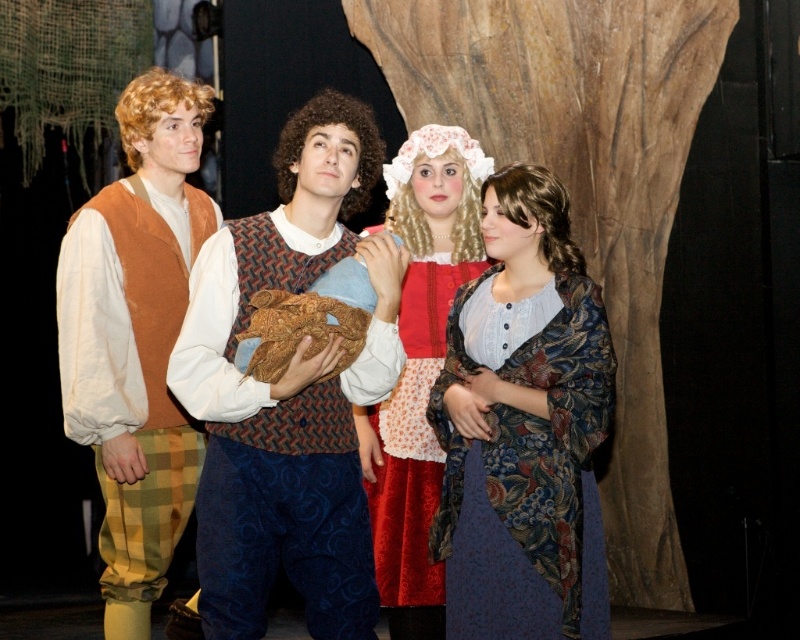
Question: In this image, where is knitted wool vest at center located relative to matte brown vest at left?

Choices:
 (A) above
 (B) below

Answer: (B)

Question: Considering the real-world distances, which object is farthest from the velvet red dress at center?

Choices:
 (A) floral brocade shawl at center
 (B) matte brown vest at left
 (C) knitted wool vest at center

Answer: (B)

Question: Among these points, which one is nearest to the camera?

Choices:
 (A) (197, 208)
 (B) (488, 157)

Answer: (B)

Question: Is the position of floral brocade shawl at center more distant than that of velvet red dress at center?

Choices:
 (A) yes
 (B) no

Answer: (B)

Question: Does floral brocade shawl at center appear on the left side of matte brown vest at left?

Choices:
 (A) no
 (B) yes

Answer: (A)

Question: Among these points, which one is nearest to the camera?

Choices:
 (A) coord(60,294)
 (B) coord(216,241)

Answer: (B)